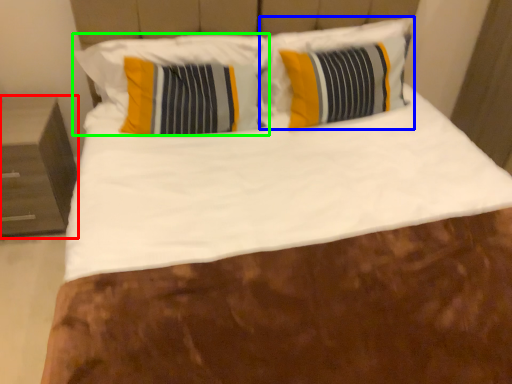
Question: Based on their relative distances, which object is nearer to nightstand (highlighted by a red box)? Choose from pillow (highlighted by a blue box) and pillow (highlighted by a green box).

Choices:
 (A) pillow
 (B) pillow

Answer: (B)